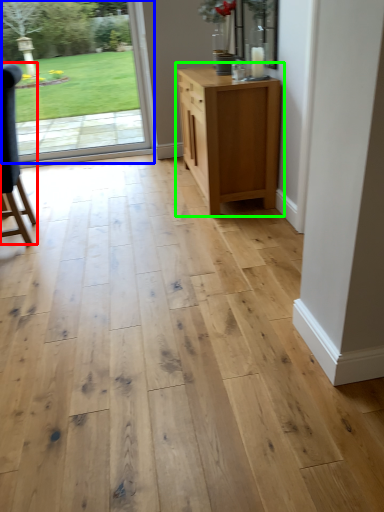
Question: Based on their relative distances, which object is nearer to chair (highlighted by a red box)? Choose from door (highlighted by a blue box) and chest of drawers (highlighted by a green box).

Choices:
 (A) door
 (B) chest of drawers

Answer: (B)